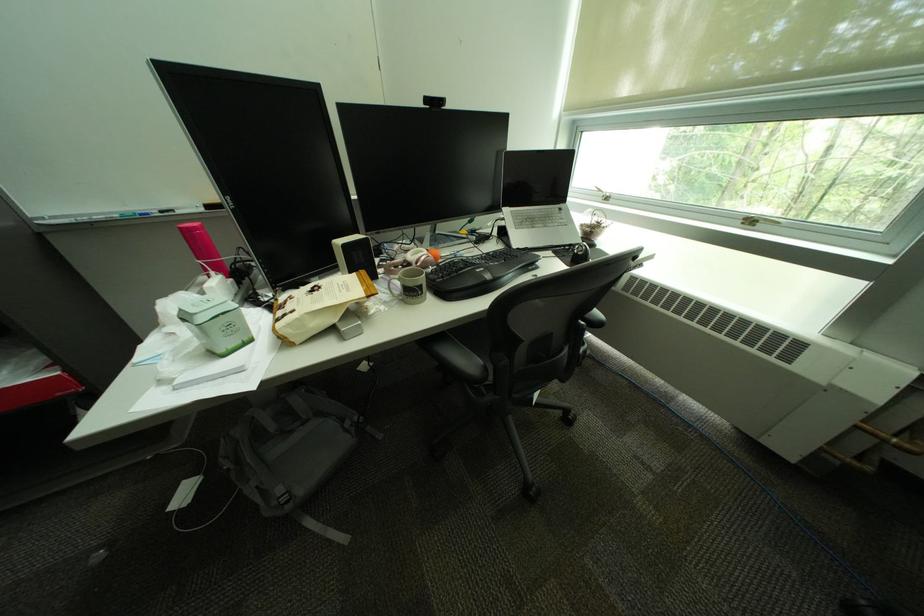
Locate an element on the screen. chair sitting surface is located at coordinates (460, 362).